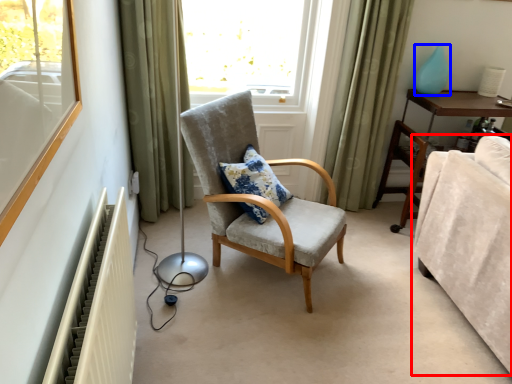
Question: Which of the following is the farthest to the observer, studio couch (highlighted by a red box) or teal (highlighted by a blue box)?

Choices:
 (A) studio couch
 (B) teal

Answer: (B)